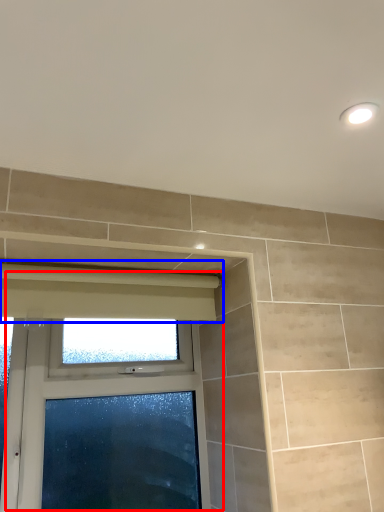
Question: Among these objects, which one is nearest to the camera, window (highlighted by a red box) or curtain (highlighted by a blue box)?

Choices:
 (A) window
 (B) curtain

Answer: (B)